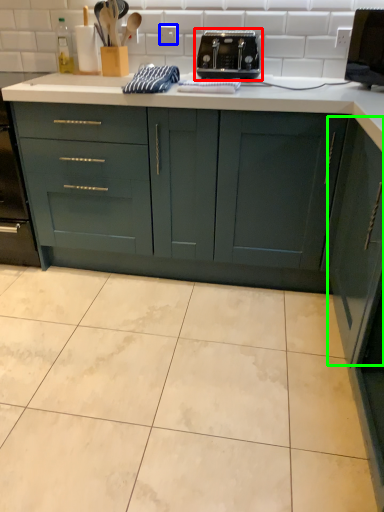
Question: Which object is the farthest from toaster (highlighted by a red box)? Choose among these: electric outlet (highlighted by a blue box) or cabinetry (highlighted by a green box).

Choices:
 (A) electric outlet
 (B) cabinetry

Answer: (B)